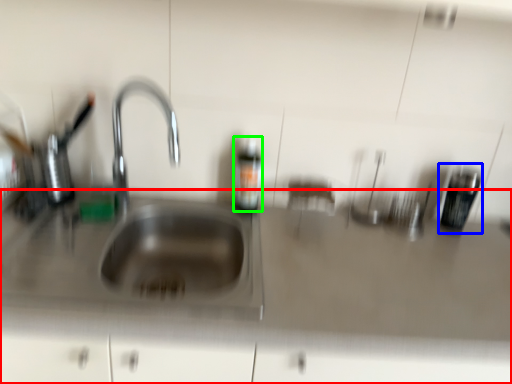
Question: Which object is the closest to the counter top (highlighted by a red box)? Choose among these: appliance (highlighted by a blue box) or bottle (highlighted by a green box).

Choices:
 (A) appliance
 (B) bottle

Answer: (B)